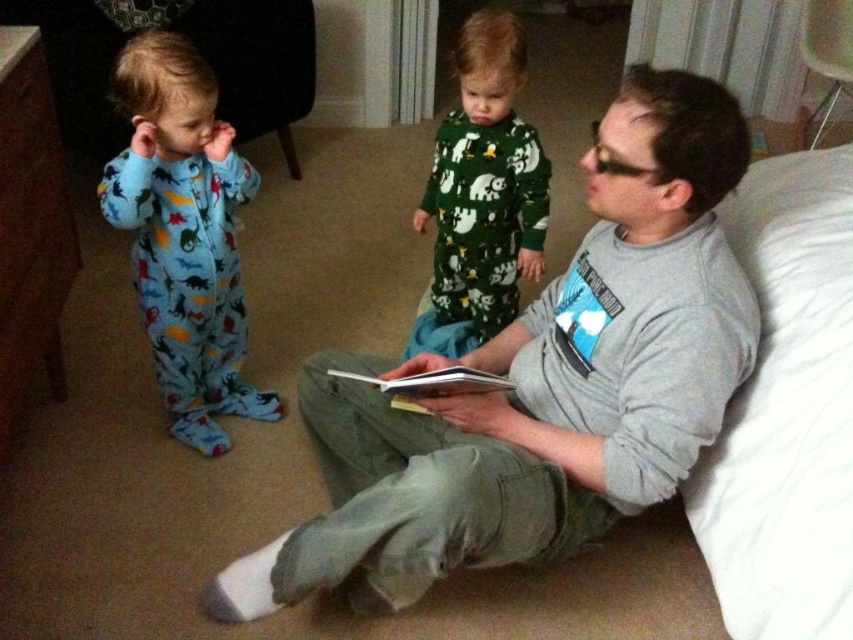
How much distance is there between gray cotton shirt at center and white soft pillow at right?

gray cotton shirt at center and white soft pillow at right are 12.60 inches apart from each other.

Is gray cotton shirt at center taller than white soft pillow at right?

Correct, gray cotton shirt at center is much taller as white soft pillow at right.

Where is `gray cotton shirt at center`? The height and width of the screenshot is (640, 853). gray cotton shirt at center is located at coordinates (543, 384).

This screenshot has height=640, width=853. Find the location of `gray cotton shirt at center`. gray cotton shirt at center is located at coordinates (543, 384).

Can you confirm if white soft pillow at right is thinner than green fuzzy pajamas at center?

In fact, white soft pillow at right might be wider than green fuzzy pajamas at center.

Which of these two, white soft pillow at right or green fuzzy pajamas at center, stands shorter?

green fuzzy pajamas at center

Which is in front, point (846, 205) or point (479, 250)?

Point (846, 205) is more forward.

Where is `white soft pillow at right`? white soft pillow at right is located at coordinates (786, 410).

Between gray cotton shirt at center and blue fleece onesie at left, which one is positioned higher?

blue fleece onesie at left

Identify the location of gray cotton shirt at center. This screenshot has height=640, width=853. (543, 384).